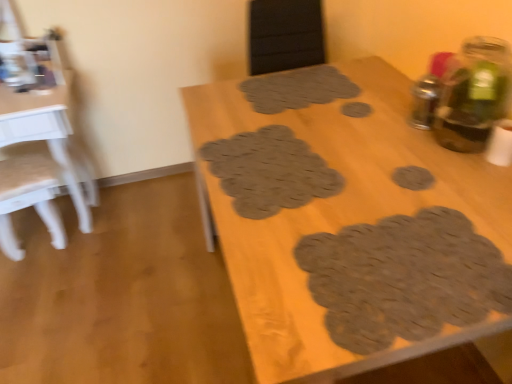
Image resolution: width=512 pixels, height=384 pixels. What are the coordinates of `vacant area that is situated to the right of white glossy table at left, which is the second table in right-to-left order` in the screenshot? It's located at (148, 232).